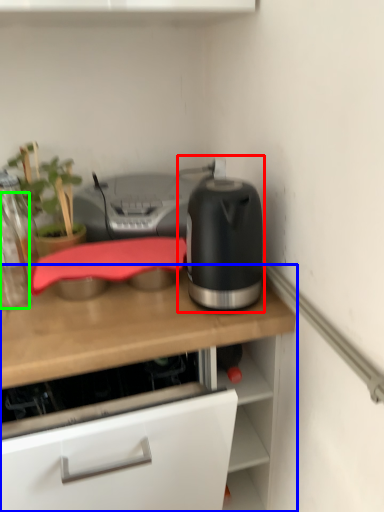
Question: Which is farther away from kitchen appliance (highlighted by a red box)? countertop (highlighted by a blue box) or bottle (highlighted by a green box)?

Choices:
 (A) countertop
 (B) bottle

Answer: (B)